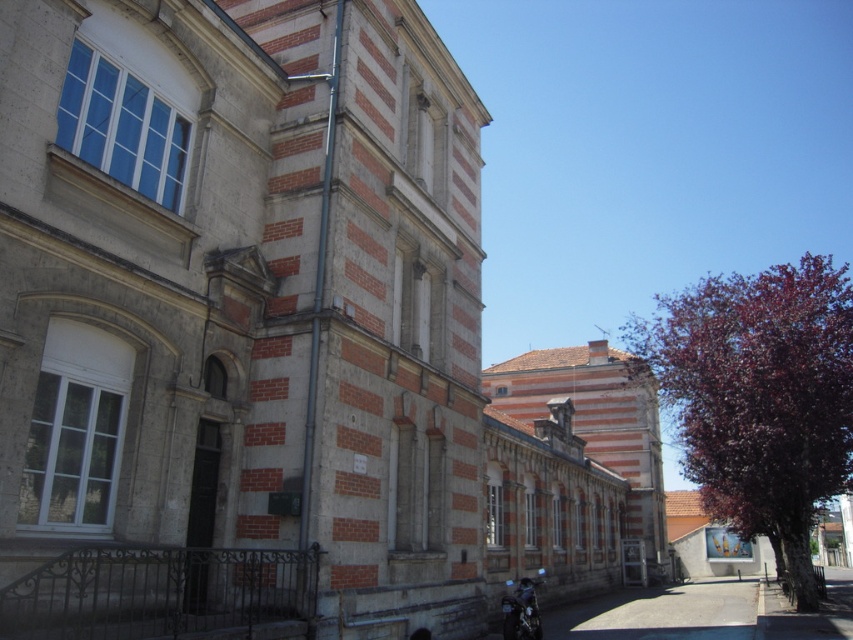
Is metallic pipe at center wider than shiny black motorcycle at lower right?

No.

Between metallic pipe at center and shiny black motorcycle at lower right, which one appears on the right side from the viewer's perspective?

shiny black motorcycle at lower right

Which is behind, point (300, 576) or point (514, 624)?

Positioned behind is point (514, 624).

At what (x,y) coordinates should I click in order to perform the action: click on metallic pipe at center. Please return your answer as a coordinate pair (x, y). The width and height of the screenshot is (853, 640). Looking at the image, I should click on (317, 292).